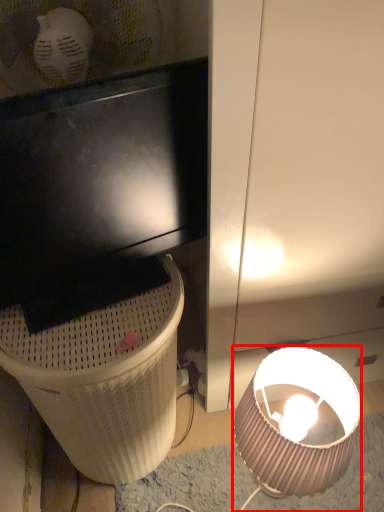
Question: From the image's perspective, what is the correct spatial relationship of lamp (annotated by the red box) in relation to trash bin/can?

Choices:
 (A) below
 (B) above

Answer: (A)